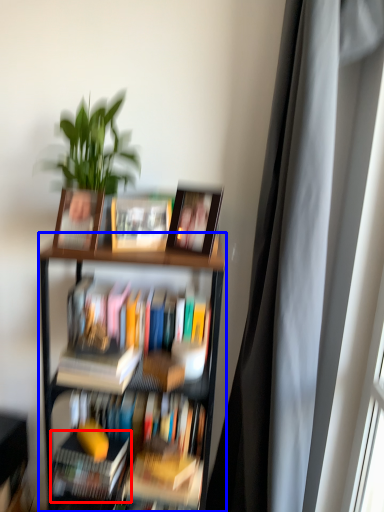
Question: Which object is further to the camera taking this photo, book (highlighted by a red box) or bookcase (highlighted by a blue box)?

Choices:
 (A) book
 (B) bookcase

Answer: (A)